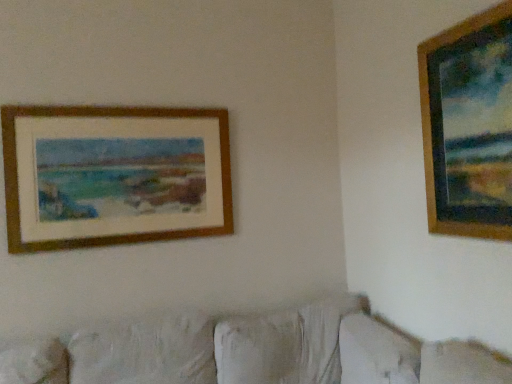
Question: Does wooden frame at upper right, arranged as the second picture frame when viewed from the back, have a lesser height compared to wooden frame at upper left, which appears as the second picture frame when viewed from the front?

Choices:
 (A) yes
 (B) no

Answer: (B)

Question: Is wooden frame at upper right, arranged as the second picture frame when viewed from the back, in contact with wooden frame at upper left, the first picture frame from the left?

Choices:
 (A) no
 (B) yes

Answer: (A)

Question: From the image's perspective, is wooden frame at upper right, arranged as the second picture frame when viewed from the back, beneath wooden frame at upper left, marked as the 1th picture frame in a back-to-front arrangement?

Choices:
 (A) no
 (B) yes

Answer: (A)

Question: Considering the relative sizes of wooden frame at upper right, which is the 1th picture frame in right-to-left order, and wooden frame at upper left, the 2th picture frame viewed from the right, in the image provided, is wooden frame at upper right, which is the 1th picture frame in right-to-left order, thinner than wooden frame at upper left, the 2th picture frame viewed from the right,?

Choices:
 (A) yes
 (B) no

Answer: (B)

Question: Does wooden frame at upper right, placed as the second picture frame when sorted from left to right, appear on the right side of wooden frame at upper left, the first picture frame from the left?

Choices:
 (A) yes
 (B) no

Answer: (A)

Question: Is wooden frame at upper left, the 2th picture frame viewed from the right, to the left or to the right of wooden frame at upper right, which is the 1th picture frame in right-to-left order, in the image?

Choices:
 (A) right
 (B) left

Answer: (B)

Question: From the image's perspective, is wooden frame at upper left, marked as the 1th picture frame in a back-to-front arrangement, located above or below wooden frame at upper right, which is the 1th picture frame in right-to-left order?

Choices:
 (A) above
 (B) below

Answer: (B)

Question: Considering their positions, is wooden frame at upper left, the first picture frame from the left, located in front of or behind wooden frame at upper right, acting as the 1th picture frame starting from the front?

Choices:
 (A) front
 (B) behind

Answer: (B)

Question: In terms of width, does wooden frame at upper left, marked as the 1th picture frame in a back-to-front arrangement, look wider or thinner when compared to wooden frame at upper right, placed as the second picture frame when sorted from left to right?

Choices:
 (A) thin
 (B) wide

Answer: (A)

Question: Considering their positions, is wooden frame at upper right, arranged as the second picture frame when viewed from the back, located in front of or behind white fabric couch at lower center?

Choices:
 (A) front
 (B) behind

Answer: (B)

Question: Visually, is wooden frame at upper right, placed as the second picture frame when sorted from left to right, positioned to the left or to the right of white fabric couch at lower center?

Choices:
 (A) right
 (B) left

Answer: (A)

Question: Considering the positions of wooden frame at upper right, acting as the 1th picture frame starting from the front, and white fabric couch at lower center in the image, is wooden frame at upper right, acting as the 1th picture frame starting from the front, bigger or smaller than white fabric couch at lower center?

Choices:
 (A) big
 (B) small

Answer: (B)

Question: Is wooden frame at upper right, placed as the second picture frame when sorted from left to right, wider or thinner than white fabric couch at lower center?

Choices:
 (A) thin
 (B) wide

Answer: (A)

Question: Is white fabric couch at lower center inside or outside of wooden frame at upper right, placed as the second picture frame when sorted from left to right?

Choices:
 (A) inside
 (B) outside

Answer: (B)

Question: From a real-world perspective, is white fabric couch at lower center above or below wooden frame at upper right, acting as the 1th picture frame starting from the front?

Choices:
 (A) above
 (B) below

Answer: (B)